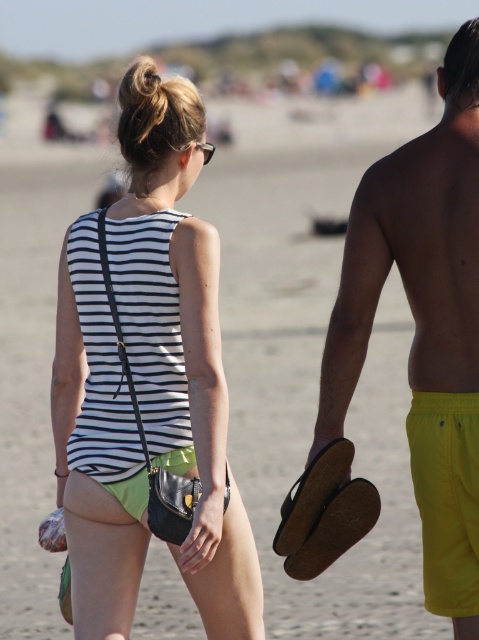
Question: Which object is positioned closest to the clear plastic goggles at upper center?

Choices:
 (A) striped fabric tank top at center
 (B) yellow fabric shorts at right

Answer: (A)

Question: Can you confirm if striped fabric tank top at center is smaller than clear plastic goggles at upper center?

Choices:
 (A) yes
 (B) no

Answer: (B)

Question: Does striped fabric tank top at center have a larger size compared to yellow fabric shorts at right?

Choices:
 (A) yes
 (B) no

Answer: (A)

Question: Is the position of striped fabric tank top at center less distant than that of yellow fabric shorts at right?

Choices:
 (A) no
 (B) yes

Answer: (B)

Question: Which of the following is the closest to the observer?

Choices:
 (A) (198, 141)
 (B) (449, 314)

Answer: (B)

Question: Which point is closer to the camera taking this photo?

Choices:
 (A) (212, 145)
 (B) (146, 208)

Answer: (B)